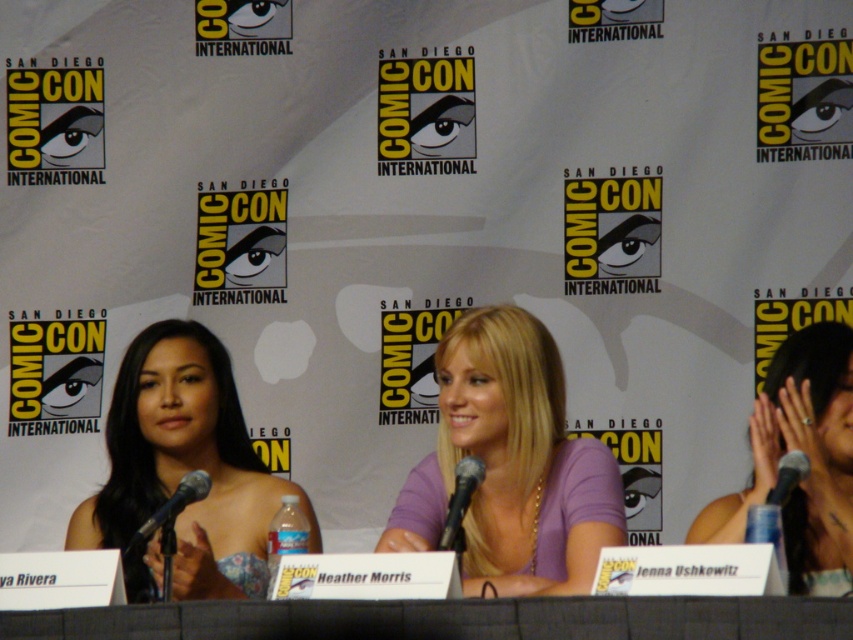
Which is above, matte black dress at left or black metallic microphone at left?

matte black dress at left is above.

Is matte black dress at left wider than black metallic microphone at left?

Yes, matte black dress at left is wider than black metallic microphone at left.

Locate an element on the screen. Image resolution: width=853 pixels, height=640 pixels. matte black dress at left is located at coordinates (186, 465).

You are a GUI agent. You are given a task and a screenshot of the screen. Output one action in this format:
    pyautogui.click(x=<x>, y=<y>)
    Task: Click on the matte black dress at left
    This screenshot has height=640, width=853.
    Given the screenshot: What is the action you would take?
    pyautogui.click(x=186, y=465)

Is purple matte shirt at center positioned before matte black dress at left?

That is True.

Is point (538, 451) in front of point (265, 572)?

That is True.

Which is in front, point (544, 426) or point (154, 444)?

Point (544, 426)

Identify the location of purple matte shirt at center. (511, 465).

Is point (495, 440) behind point (741, 632)?

Yes.

Is purple matte shirt at center below black fabric table at center?

Incorrect, purple matte shirt at center is not positioned below black fabric table at center.

Does point (566, 486) lie behind point (369, 634)?

Yes, it is behind point (369, 634).

The image size is (853, 640). Find the location of `purple matte shirt at center`. purple matte shirt at center is located at coordinates (511, 465).